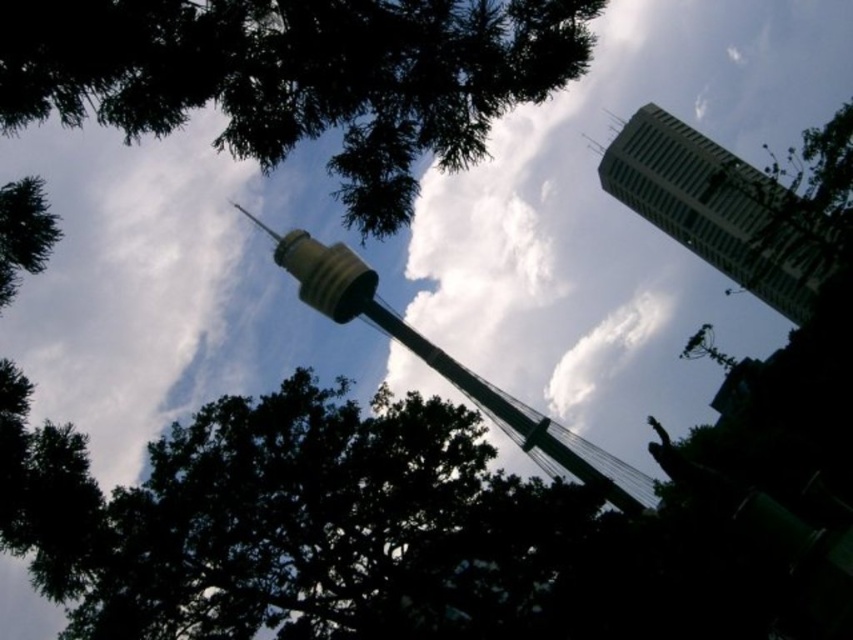
You are a photographer planning to capture a wide shot of the Sydney skyline. You notice the green leafy tree at upper left and the green metallic tower at center in your viewfinder. Based on their sizes in the image, which object would appear closer to the camera?

The green leafy tree at upper left appears closer to the camera because it has a smaller size compared to the green metallic tower at center, indicating it is farther away.